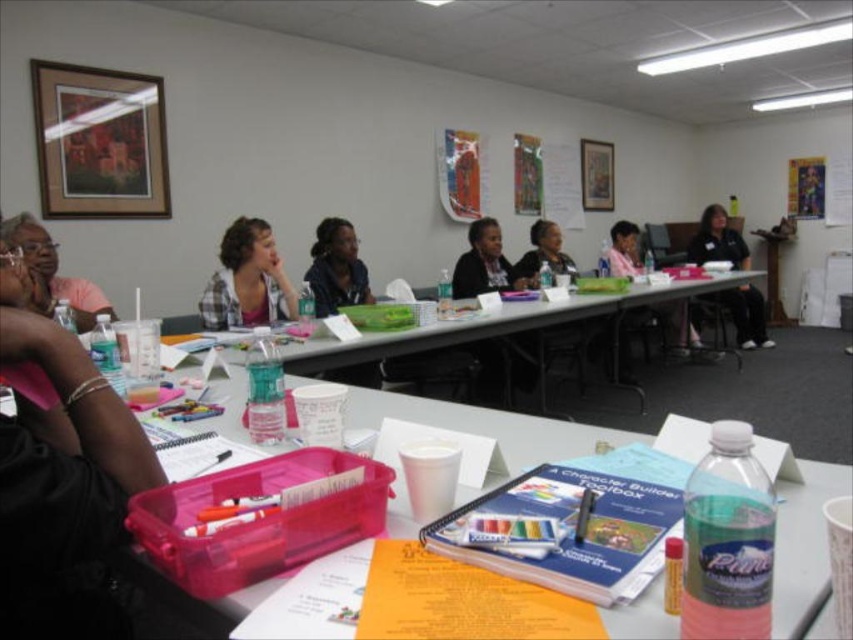
Is matte pink shirt at upper left smaller than black fabric shirt at right?

Indeed, matte pink shirt at upper left has a smaller size compared to black fabric shirt at right.

Does point (26, 250) come behind point (714, 227)?

No, (26, 250) is closer to viewer.

Between point (44, 257) and point (747, 291), which one is positioned behind?

Positioned behind is point (747, 291).

Where is `matte pink shirt at upper left`? matte pink shirt at upper left is located at coordinates (51, 273).

Is point (515, 304) positioned behind point (711, 216)?

No, it is not.

Can you confirm if white plastic table at center is positioned to the left of black fabric shirt at right?

Correct, you'll find white plastic table at center to the left of black fabric shirt at right.

Which is behind, point (689, 282) or point (712, 225)?

Point (712, 225)

What are the coordinates of `white plastic table at center` in the screenshot? It's located at (496, 323).

Does matte pink shirt at upper left have a lesser width compared to matte black shirt at center?

Yes.

Can you confirm if matte pink shirt at upper left is bigger than matte black shirt at center?

No.

You are a GUI agent. You are given a task and a screenshot of the screen. Output one action in this format:
    pyautogui.click(x=<x>, y=<y>)
    Task: Click on the matte pink shirt at upper left
    This screenshot has width=853, height=640.
    Given the screenshot: What is the action you would take?
    pyautogui.click(x=51, y=273)